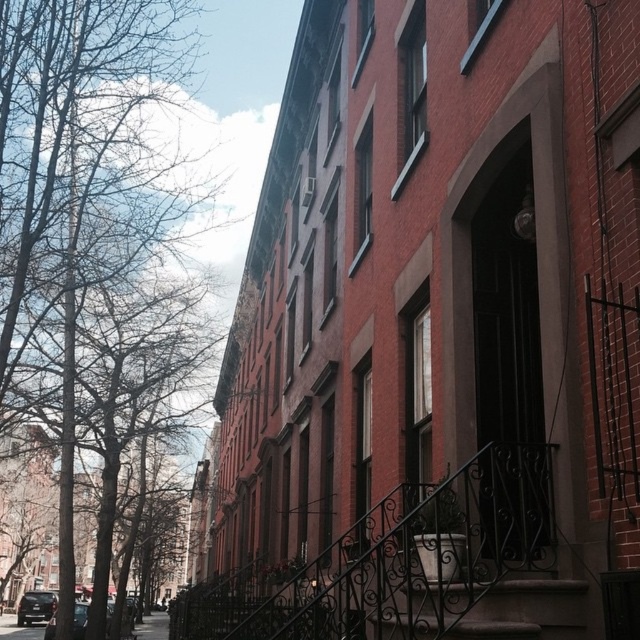
Question: Can you confirm if dark brown wrought iron stairs at center is bigger than concrete pavement at lower left?

Choices:
 (A) yes
 (B) no

Answer: (B)

Question: Where is dark brown wrought iron stairs at center located in relation to concrete pavement at lower left in the image?

Choices:
 (A) above
 (B) below

Answer: (A)

Question: Which point is farther from the camera taking this photo?

Choices:
 (A) [33, 612]
 (B) [161, 621]

Answer: (B)

Question: Which of the following is the farthest from the observer?

Choices:
 (A) dark brown wrought iron stairs at center
 (B) concrete pavement at lower left
 (C) bare branches at upper left
 (D) shiny black car at lower left

Answer: (D)

Question: Which object is the farthest from the shiny black car at lower left?

Choices:
 (A) dark brown wrought iron stairs at center
 (B) bare branches at upper left

Answer: (A)

Question: Is the position of concrete pavement at lower left more distant than that of shiny black car at lower left?

Choices:
 (A) no
 (B) yes

Answer: (A)